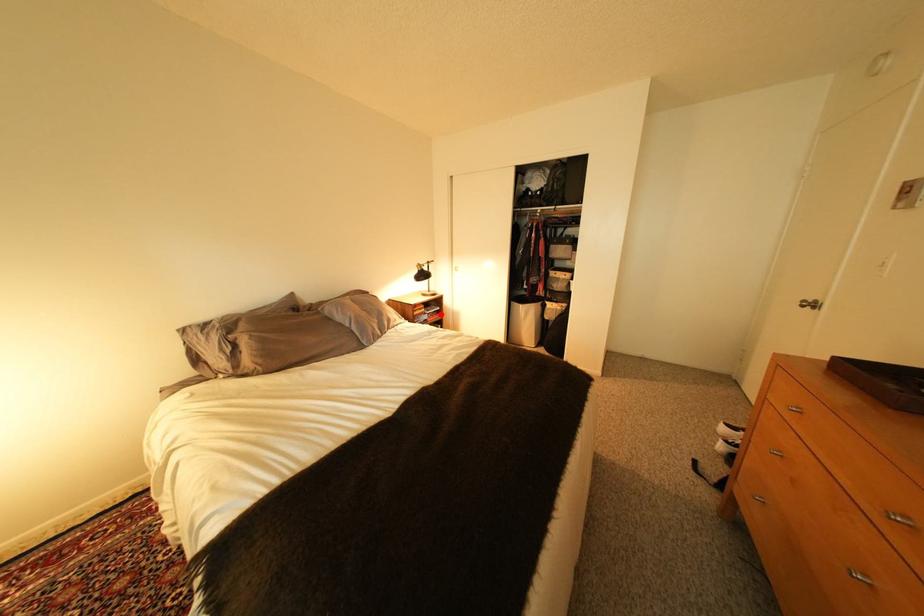
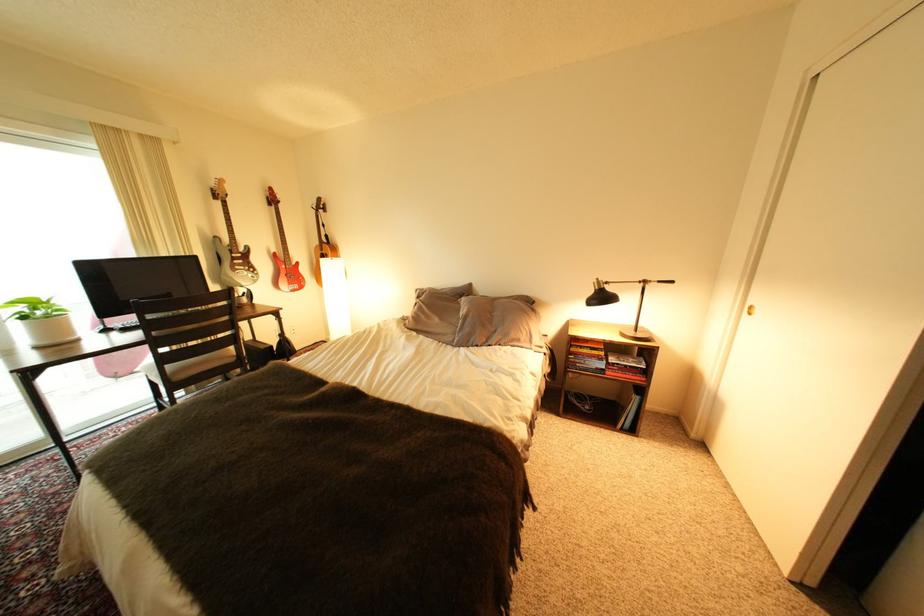
Question: I am providing you with two images of the same scene from different viewpoints. In image1, a red point is highlighted. Considering the same 3D point in image2, which of the following is correct?

Choices:
 (A) It is closer
 (B) It is farther

Answer: (B)